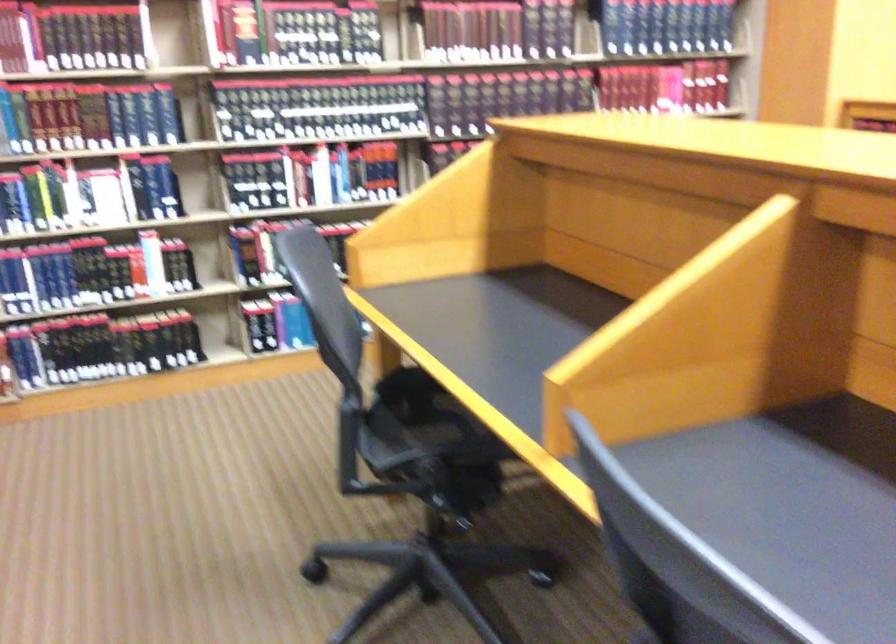
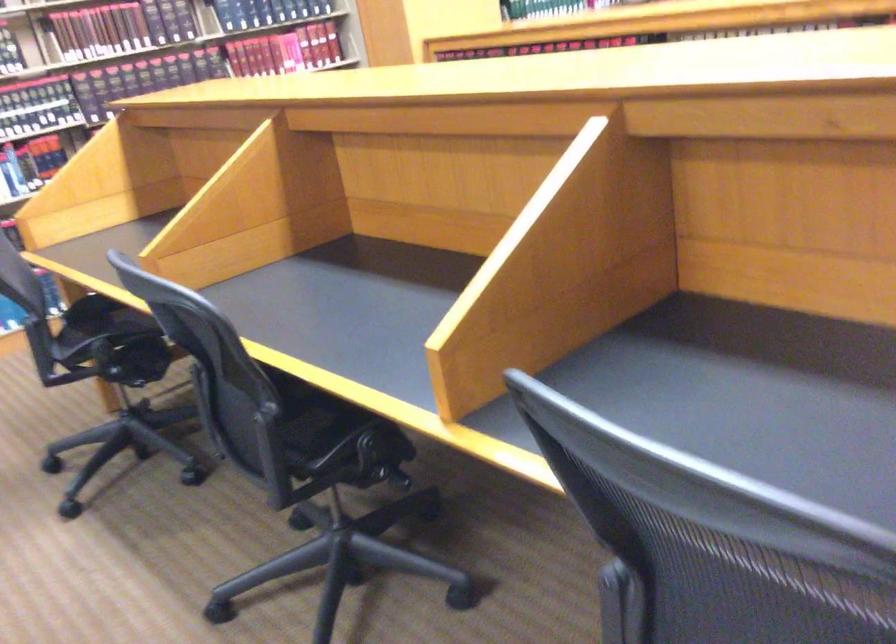
Where in the second image is the point corresponding to point 652,93 from the first image?

(271, 55)